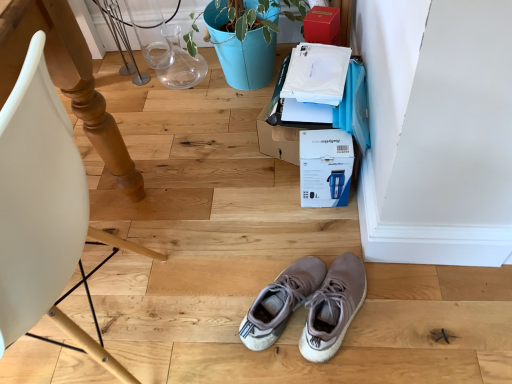
Question: Considering the positions of matte wood chair at left and light gray suede sneakers at center in the image, is matte wood chair at left bigger or smaller than light gray suede sneakers at center?

Choices:
 (A) big
 (B) small

Answer: (A)

Question: Would you say matte wood chair at left is inside or outside light gray suede sneakers at center?

Choices:
 (A) outside
 (B) inside

Answer: (A)

Question: Which object is positioned farthest from the matte wood chair at left?

Choices:
 (A) matte cardboard box at upper right, which appears as the 2th cardboard box when ordered from the bottom
 (B) blue cardboard box at center, which is counted as the 1th cardboard box, starting from the bottom
 (C) light gray suede sneakers at center

Answer: (A)

Question: Based on their relative distances, which object is nearer to the matte cardboard box at upper right, the first cardboard box positioned from the top?

Choices:
 (A) light gray suede sneakers at center
 (B) matte wood chair at left
 (C) blue cardboard box at center, which is counted as the 1th cardboard box, starting from the bottom

Answer: (C)